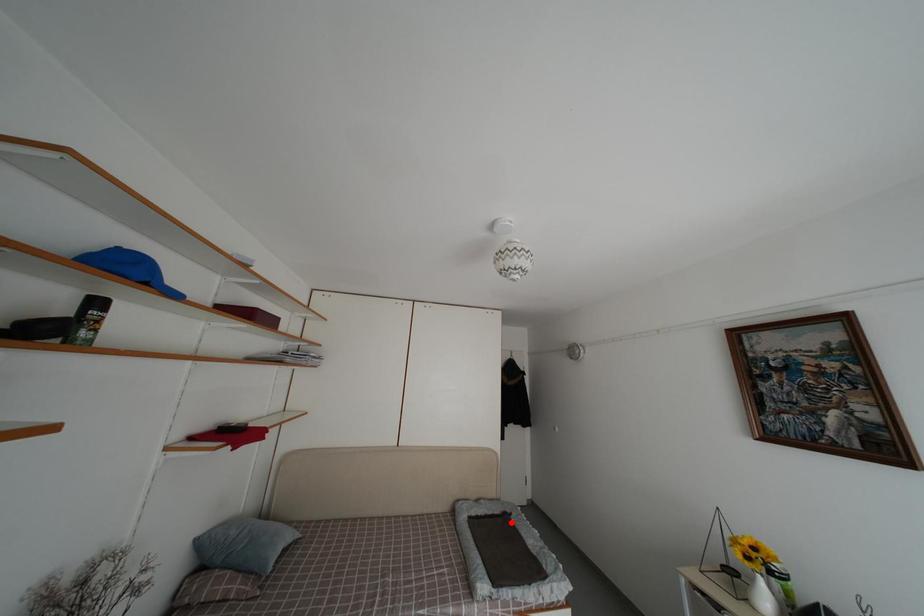
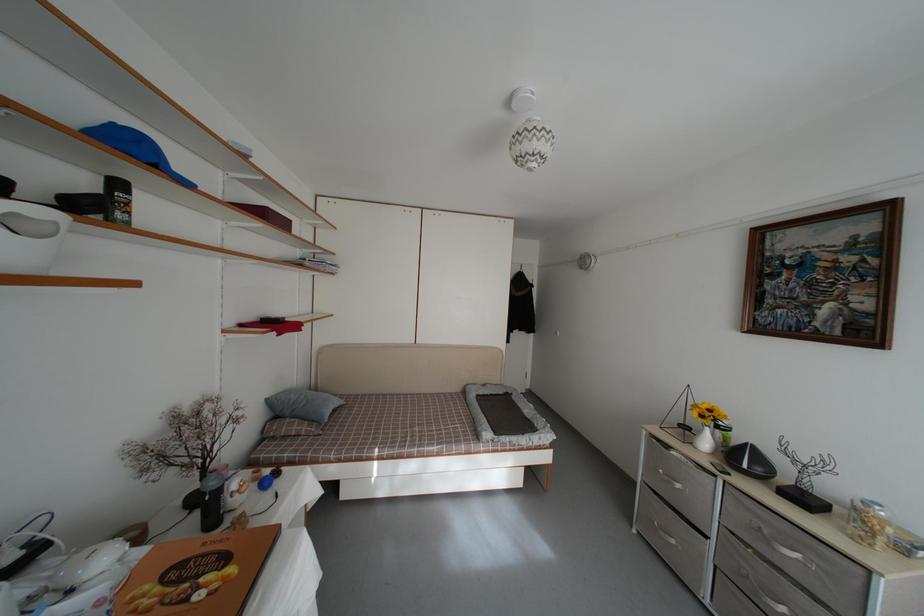
Locate, in the second image, the point that corresponds to the highlighted location in the first image.

(513, 402)